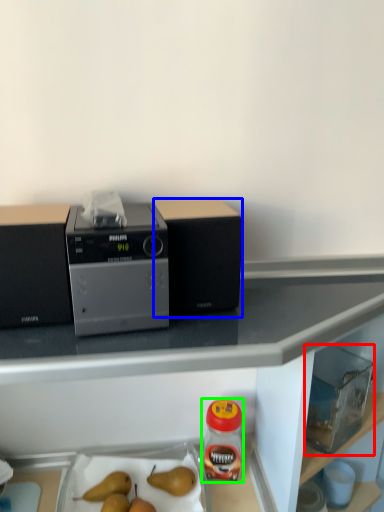
Question: Which object is the farthest from appliance (highlighted by a red box)? Choose among these: kitchen appliance (highlighted by a blue box) or bottle (highlighted by a green box).

Choices:
 (A) kitchen appliance
 (B) bottle

Answer: (A)